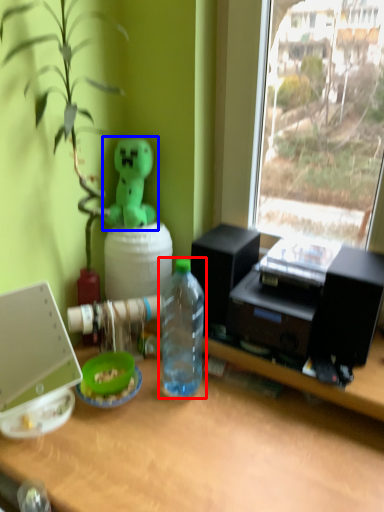
Question: Among these objects, which one is nearest to the camera, bottle (highlighted by a red box) or toy (highlighted by a blue box)?

Choices:
 (A) bottle
 (B) toy

Answer: (A)